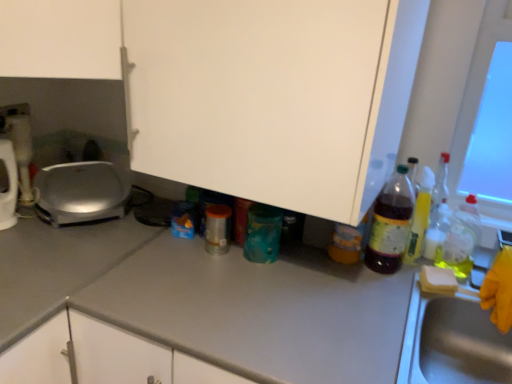
Find the location of a particular element. free space that is in between translucent plastic bottle at right, which is the 3th bottle from left to right, and teal matte canister at center, the 4th bottle in the right-to-left sequence is located at coordinates pyautogui.click(x=314, y=262).